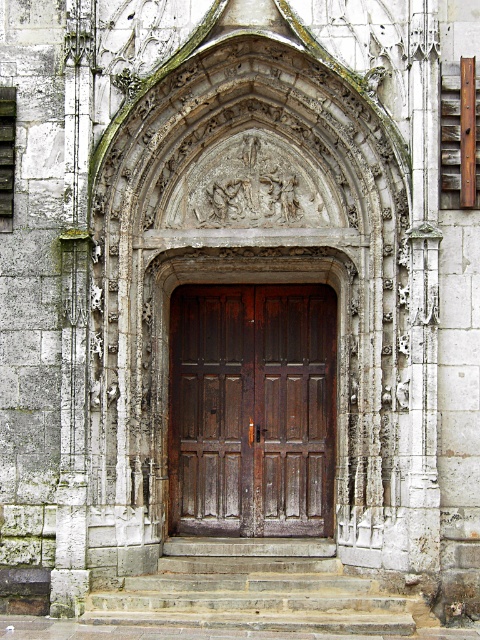
Question: Is dark brown wood door at center positioned behind stone steps at center?

Choices:
 (A) no
 (B) yes

Answer: (B)

Question: Can you confirm if dark brown wood door at center is wider than stone steps at center?

Choices:
 (A) no
 (B) yes

Answer: (A)

Question: Which point is farther from the camera taking this photo?

Choices:
 (A) (376, 616)
 (B) (224, 492)

Answer: (B)

Question: Where is dark brown wood door at center located in relation to stone steps at center in the image?

Choices:
 (A) right
 (B) left

Answer: (B)

Question: Among these points, which one is nearest to the camera?

Choices:
 (A) (245, 500)
 (B) (238, 573)

Answer: (B)

Question: Which object appears farthest from the camera in this image?

Choices:
 (A) stone steps at center
 (B) dark brown wood door at center

Answer: (B)